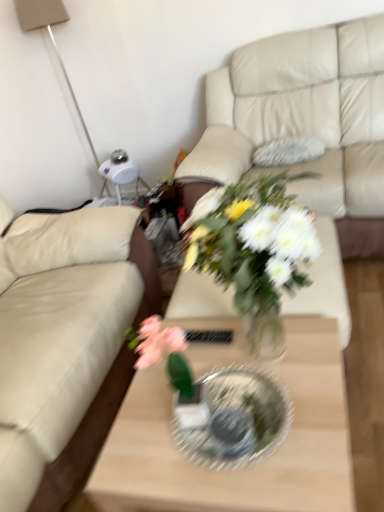
Question: Considering the relative sizes of translucent glass vase at center and matte white lamp at upper left in the image provided, is translucent glass vase at center smaller than matte white lamp at upper left?

Choices:
 (A) yes
 (B) no

Answer: (A)

Question: From a real-world perspective, is translucent glass vase at center on matte white lamp at upper left?

Choices:
 (A) yes
 (B) no

Answer: (B)

Question: Does translucent glass vase at center have a greater width compared to matte white lamp at upper left?

Choices:
 (A) no
 (B) yes

Answer: (B)

Question: Is translucent glass vase at center to the left of matte white lamp at upper left from the viewer's perspective?

Choices:
 (A) no
 (B) yes

Answer: (A)

Question: Would you say translucent glass vase at center is outside matte white lamp at upper left?

Choices:
 (A) no
 (B) yes

Answer: (B)

Question: Can you confirm if translucent glass vase at center is shorter than matte white lamp at upper left?

Choices:
 (A) yes
 (B) no

Answer: (A)

Question: Considering the relative sizes of clear glass plate at center and matte white lamp at upper left in the image provided, is clear glass plate at center shorter than matte white lamp at upper left?

Choices:
 (A) yes
 (B) no

Answer: (A)

Question: Is clear glass plate at center located outside matte white lamp at upper left?

Choices:
 (A) no
 (B) yes

Answer: (B)

Question: Is clear glass plate at center positioned in front of matte white lamp at upper left?

Choices:
 (A) no
 (B) yes

Answer: (B)

Question: Is clear glass plate at center far from matte white lamp at upper left?

Choices:
 (A) no
 (B) yes

Answer: (B)

Question: Is clear glass plate at center facing towards matte white lamp at upper left?

Choices:
 (A) no
 (B) yes

Answer: (A)

Question: From the image's perspective, does clear glass plate at center appear higher than matte white lamp at upper left?

Choices:
 (A) no
 (B) yes

Answer: (A)

Question: Can you confirm if clear glass coffee table at center is taller than beige leather couch at left, the first studio couch from the left?

Choices:
 (A) yes
 (B) no

Answer: (B)